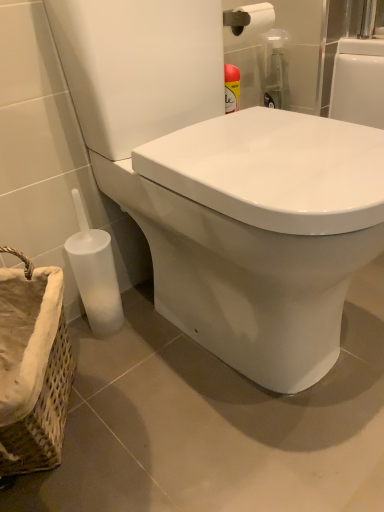
Identify the location of free space on the front side of white matte toilet brush at lower left. (128, 372).